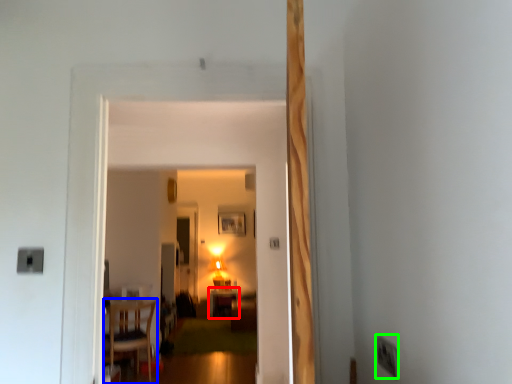
Question: Which object is positioned closest to table (highlighted by a red box)? Select from chair (highlighted by a blue box) and electric outlet (highlighted by a green box).

Choices:
 (A) chair
 (B) electric outlet

Answer: (A)